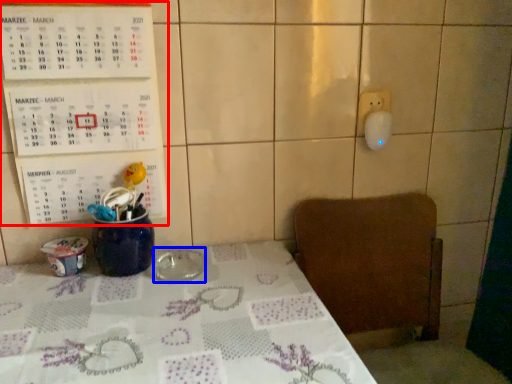
Question: Which point is closer to the camera, bulletin board (highlighted by a red box) or tableware (highlighted by a blue box)?

Choices:
 (A) bulletin board
 (B) tableware

Answer: (A)